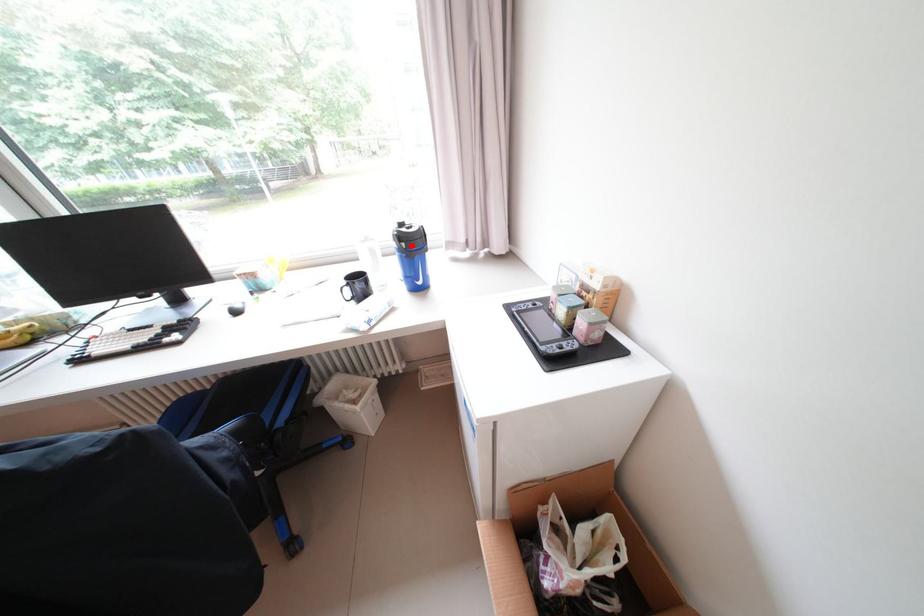
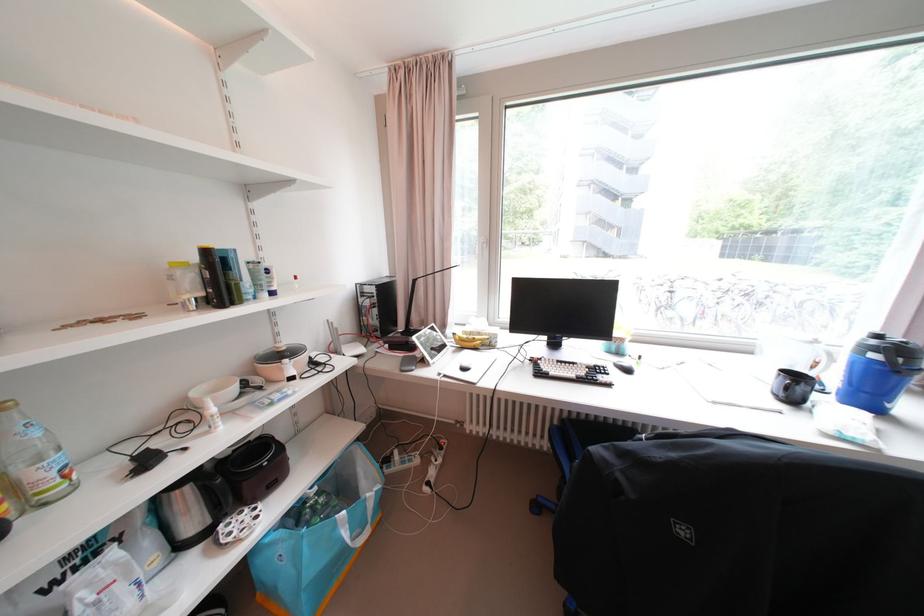
Question: I am providing you with two images of the same scene from different viewpoints. Image1 has a red point marked. In image2, the corresponding 3D location appears at what relative position? Reply with the corresponding letter.

Choices:
 (A) Closer
 (B) Farther

Answer: (A)